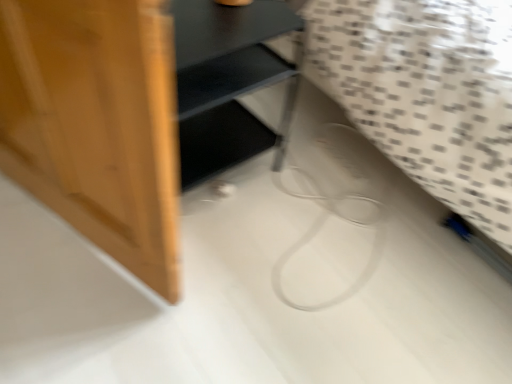
Image resolution: width=512 pixels, height=384 pixels. What are the coordinates of `vacant area that lies to the right of matte black shelf at center` in the screenshot? It's located at (313, 183).